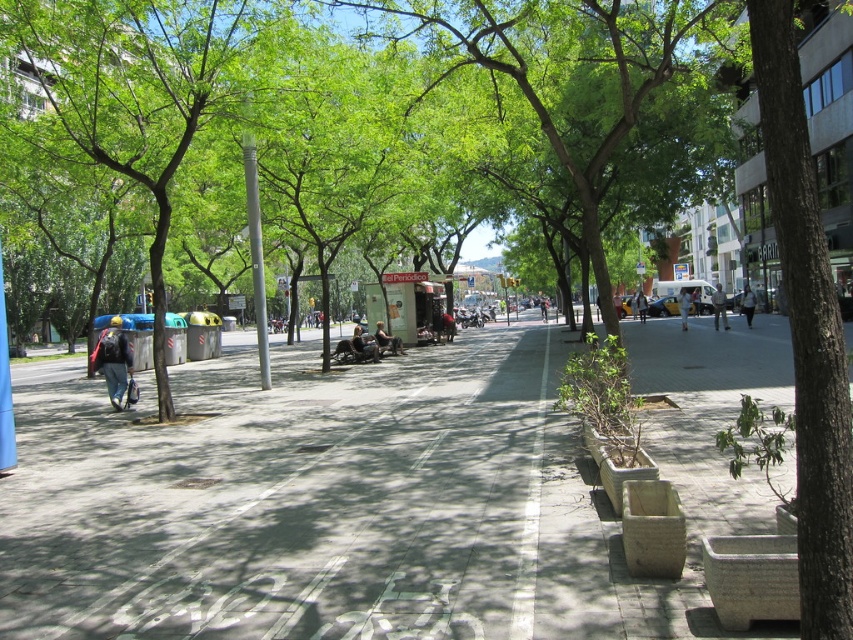
Question: Which object appears closest to the camera in this image?

Choices:
 (A) matte black jacket at center
 (B) light brown leather jacket at center
 (C) leather jacket at center
 (D) white cotton shirt at center

Answer: (C)

Question: Can you confirm if leather jacket at center is positioned above white cotton pants at center?

Choices:
 (A) no
 (B) yes

Answer: (A)

Question: Among these points, which one is farthest from the camera?

Choices:
 (A) (457, 554)
 (B) (541, 300)
 (C) (744, 307)
 (D) (785, 225)

Answer: (B)

Question: Can you confirm if matte black backpack at left is wider than light brown leather jacket at center?

Choices:
 (A) no
 (B) yes

Answer: (A)

Question: Is matte black backpack at left wider than matte black jacket at center?

Choices:
 (A) no
 (B) yes

Answer: (B)

Question: Among these objects, which one is nearest to the camera?

Choices:
 (A) light blue jeans at center
 (B) matte black jacket at center
 (C) gray concrete pavement at center
 (D) green leafy tree at left

Answer: (C)